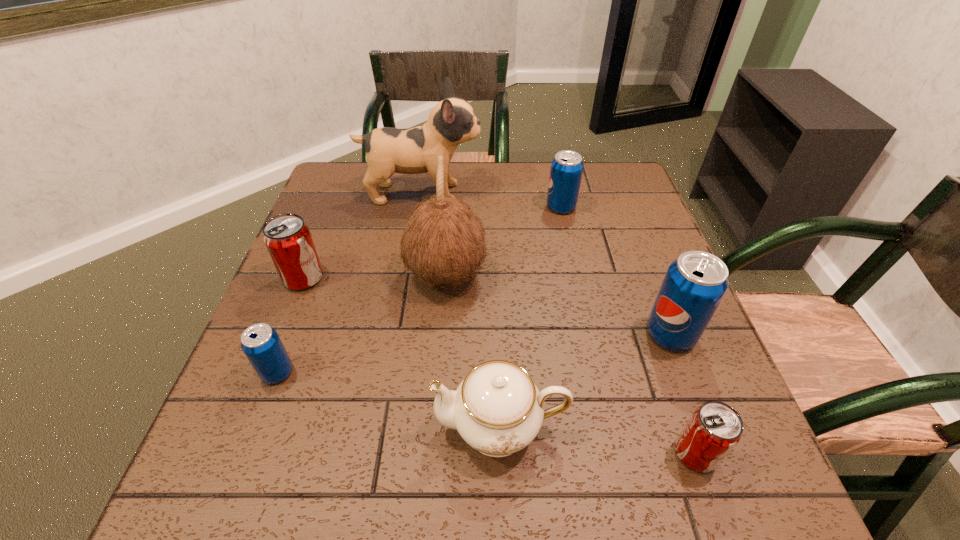
Locate an element on the screen. puppy is located at coordinates (451, 122).

This screenshot has height=540, width=960. I want to click on coconut, so click(x=443, y=242).

Find the location of a particular element. This screenshot has height=540, width=960. the biggest blue pop soda is located at coordinates (694, 285).

Identify the location of the fourth nearest object. The height and width of the screenshot is (540, 960). (694, 285).

Where is `the farthest blue pop soda`? the farthest blue pop soda is located at coordinates (566, 170).

Where is `the farthest pop soda`? the farthest pop soda is located at coordinates (566, 170).

At what (x,y) coordinates should I click in order to perform the action: click on the farther red pop soda. Please return your answer as a coordinate pair (x, y). The width and height of the screenshot is (960, 540). Looking at the image, I should click on (288, 239).

Image resolution: width=960 pixels, height=540 pixels. What are the coordinates of `the fourth nearest pop soda` in the screenshot? It's located at (288, 239).

Identify the location of chinaware. (497, 409).

At what (x,y) coordinates should I click in order to perform the action: click on the leftmost blue pop soda. Please return your answer as a coordinate pair (x, y). This screenshot has width=960, height=540. Looking at the image, I should click on (261, 344).